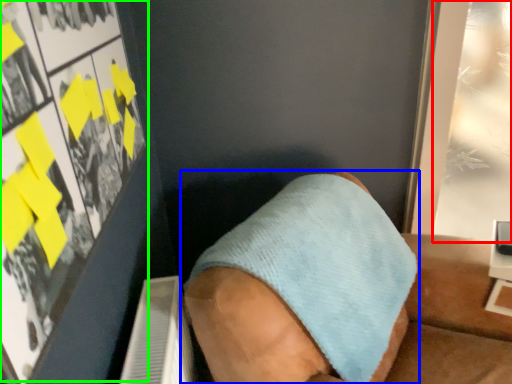
Question: Based on their relative distances, which object is farther from poster page (highlighted by a red box)? Choose from footwear (highlighted by a blue box) and poster page (highlighted by a green box).

Choices:
 (A) footwear
 (B) poster page

Answer: (B)